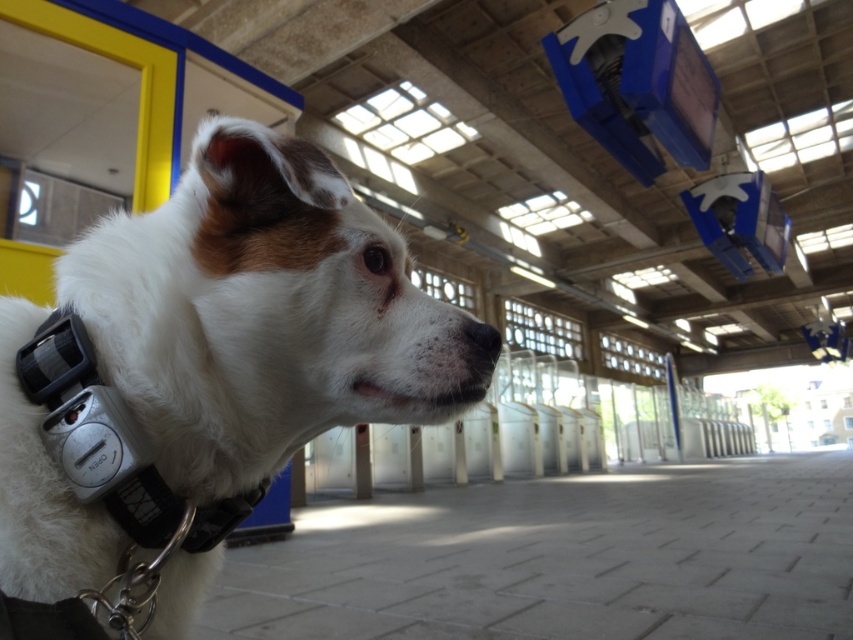
Is the position of white fur dog at center more distant than that of silver/black plastic neckband at left?

No, it is not.

Can you confirm if white fur dog at center is taller than silver/black plastic neckband at left?

Indeed, white fur dog at center has a greater height compared to silver/black plastic neckband at left.

Measure the distance between white fur dog at center and camera.

white fur dog at center is 16.50 inches from camera.

The width and height of the screenshot is (853, 640). I want to click on white fur dog at center, so click(201, 380).